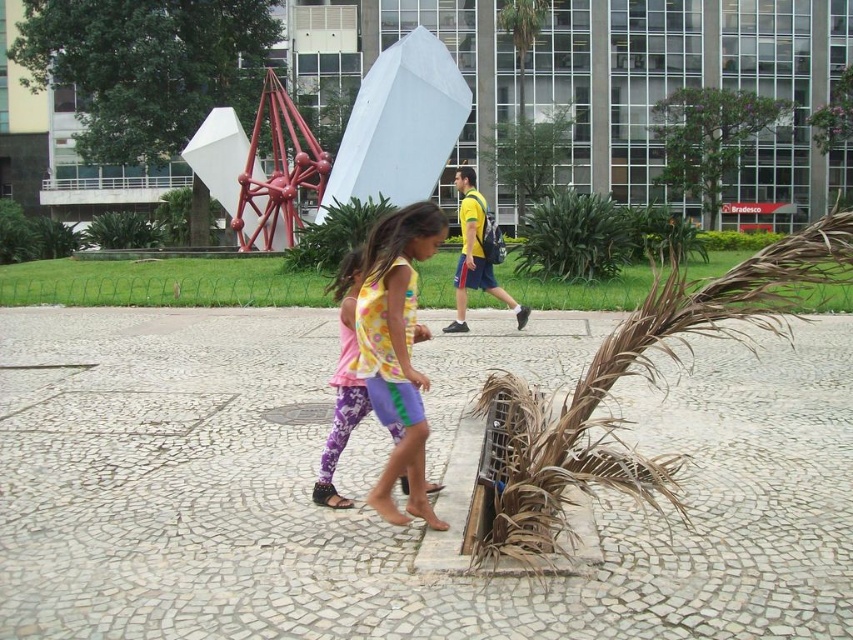
Question: Does brown dried palm at lower right appear on the left side of brown textured palm tree at upper center?

Choices:
 (A) no
 (B) yes

Answer: (A)

Question: Which point is closer to the camera taking this photo?

Choices:
 (A) (527, 45)
 (B) (535, 465)

Answer: (B)

Question: Which of the following is the closest to the observer?

Choices:
 (A) brown dried palm at lower right
 (B) brown textured palm tree at upper center

Answer: (A)

Question: Does multicolored fabric dress at center appear over brown textured palm tree at upper center?

Choices:
 (A) yes
 (B) no

Answer: (B)

Question: Which object is positioned closest to the brown dried palm at lower right?

Choices:
 (A) multicolored fabric dress at center
 (B) brown textured palm tree at upper center

Answer: (A)

Question: Can you confirm if brown dried palm at lower right is positioned above brown textured palm tree at upper center?

Choices:
 (A) no
 (B) yes

Answer: (A)